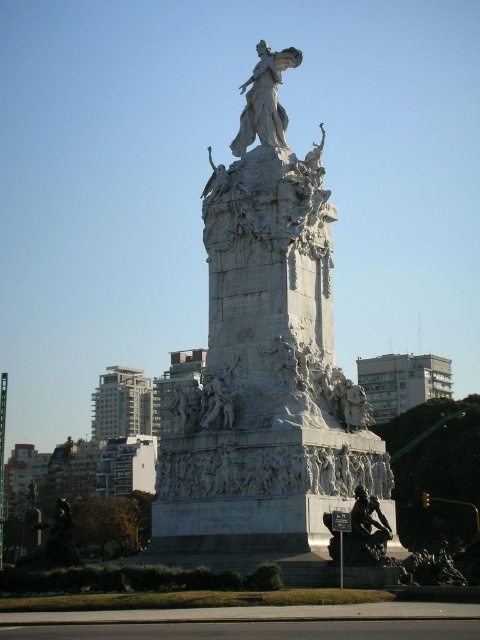
Does white marble monument at center have a smaller size compared to white marble statue at center?

Incorrect, white marble monument at center is not smaller in size than white marble statue at center.

Who is taller, white marble monument at center or white marble statue at center?

white marble monument at center

The height and width of the screenshot is (640, 480). I want to click on white marble monument at center, so click(x=265, y=358).